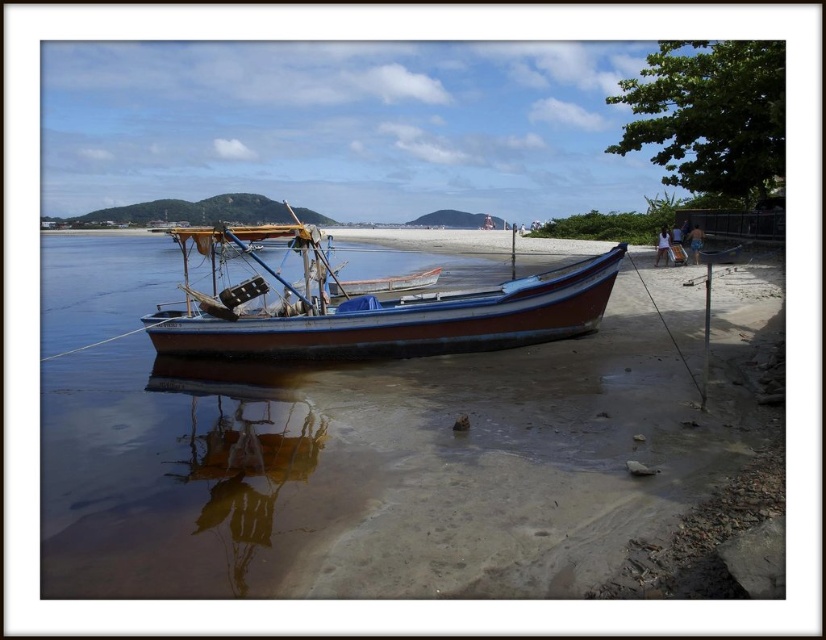
Does brown reflective water at center have a greater height compared to wooden boat at center?

Indeed, brown reflective water at center has a greater height compared to wooden boat at center.

The image size is (826, 640). What are the coordinates of `brown reflective water at center` in the screenshot? It's located at (366, 449).

Who is more forward, (x=415, y=506) or (x=279, y=339)?

Point (x=415, y=506)

Find the location of a particular element. This screenshot has width=826, height=640. brown reflective water at center is located at coordinates (366, 449).